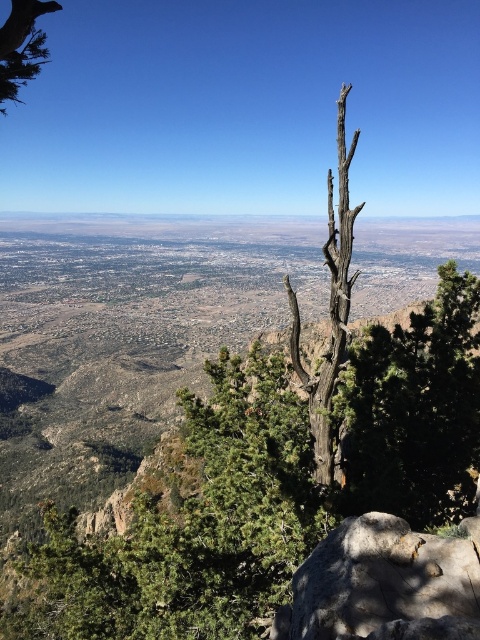
Who is positioned more to the right, gray rough rock at lower right or green matte tree at upper left?

Positioned to the right is gray rough rock at lower right.

Measure the distance from gray rough rock at lower right to green matte tree at upper left.

gray rough rock at lower right and green matte tree at upper left are 112.28 feet apart from each other.

Which is in front, point (360, 596) or point (48, 10)?

Point (360, 596) is more forward.

Find the location of a particular element. The width and height of the screenshot is (480, 640). gray rough rock at lower right is located at coordinates (384, 586).

Which is below, dark brown bark tree at center or gray rough rock at lower right?

Positioned lower is dark brown bark tree at center.

Measure the distance between point (396, 461) and camera.

A distance of 111.85 feet exists between point (396, 461) and camera.

At what (x,y) coordinates should I click in order to perform the action: click on dark brown bark tree at center. Please return your answer as a coordinate pair (x, y). The width and height of the screenshot is (480, 640). Looking at the image, I should click on (272, 486).

Is charcoal textured tree trunk at center bigger than green matte tree at upper left?

Correct, charcoal textured tree trunk at center is larger in size than green matte tree at upper left.

Does point (337, 356) come closer to viewer compared to point (21, 29)?

No, it is not.

You are a GUI agent. You are given a task and a screenshot of the screen. Output one action in this format:
    pyautogui.click(x=<x>, y=<y>)
    Task: Click on the charcoal textured tree trunk at center
    The image size is (480, 640).
    Given the screenshot: What is the action you would take?
    pyautogui.click(x=330, y=307)